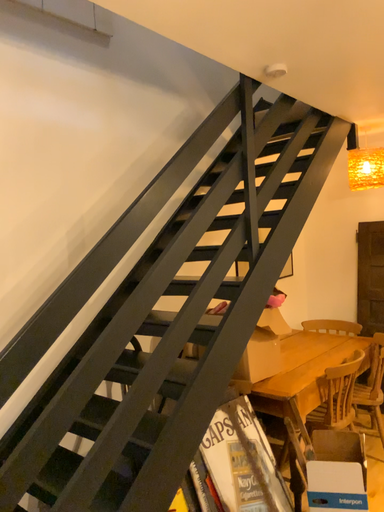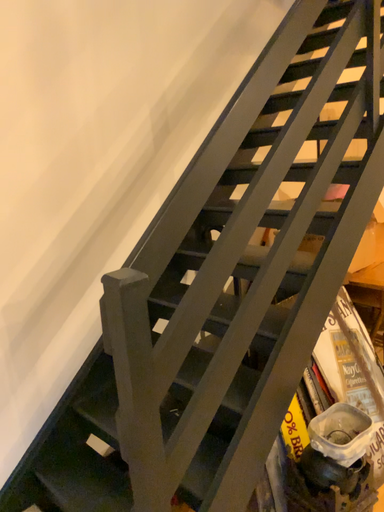
Question: How did the camera likely rotate when shooting the video?

Choices:
 (A) rotated upward
 (B) rotated downward

Answer: (B)